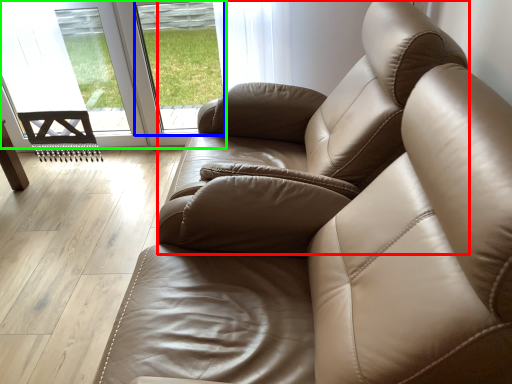
Question: Which is farther away from armchair (highlighted by a red box)? window (highlighted by a blue box) or glass door (highlighted by a green box)?

Choices:
 (A) window
 (B) glass door

Answer: (A)